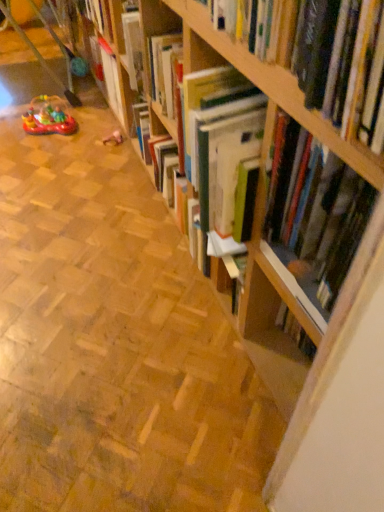
Identify the location of free region under rubber boat at left, placed as the second toy when sorted from right to left (from a real-world perspective). This screenshot has width=384, height=512. (56, 131).